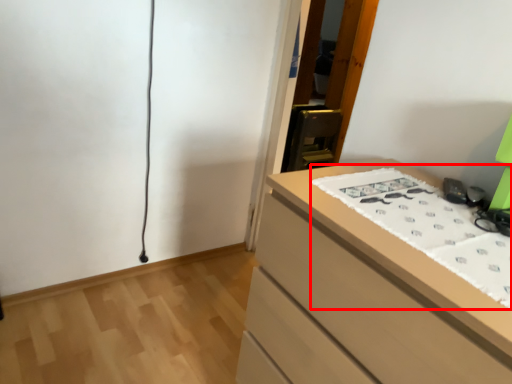
Question: From the image's perspective, where is sheet (annotated by the red box) located relative to chest of drawers?

Choices:
 (A) below
 (B) above

Answer: (B)